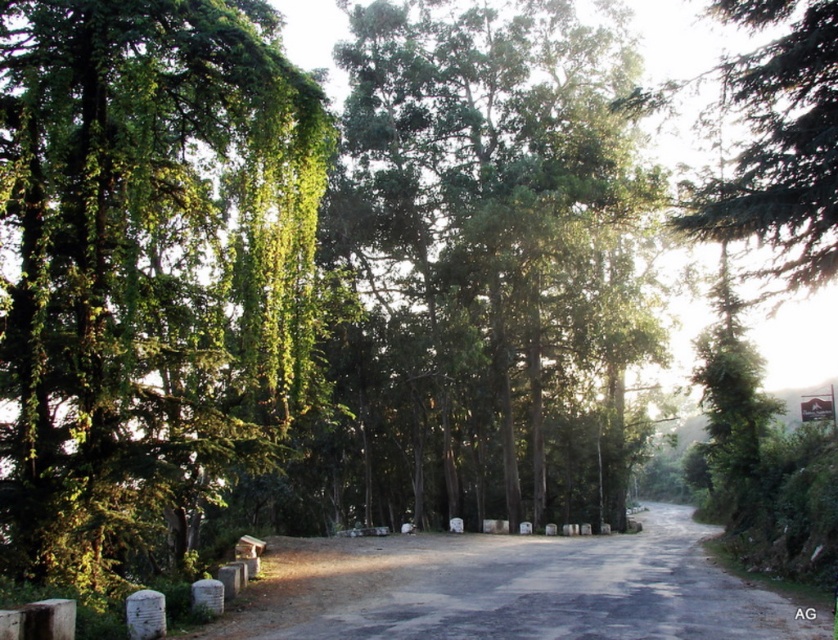
Is point (224, 163) in front of point (580, 349)?

That is True.

Looking at this image, can you confirm if green leafy tree at left is positioned to the left of green leafy trees at center?

Correct, you'll find green leafy tree at left to the left of green leafy trees at center.

Does point (161, 109) come in front of point (597, 12)?

Yes, it is.

The width and height of the screenshot is (838, 640). I want to click on green leafy tree at left, so click(145, 268).